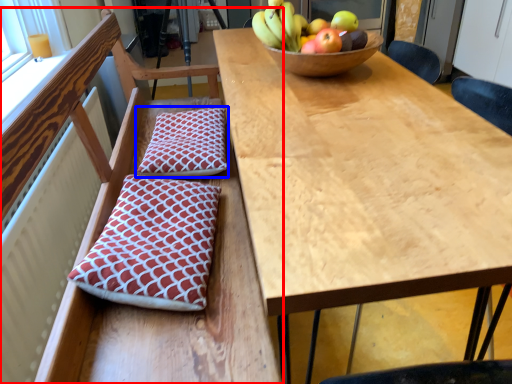
Question: Which object appears closest to the camera in this image, chair (highlighted by a red box) or pillow (highlighted by a blue box)?

Choices:
 (A) chair
 (B) pillow

Answer: (A)